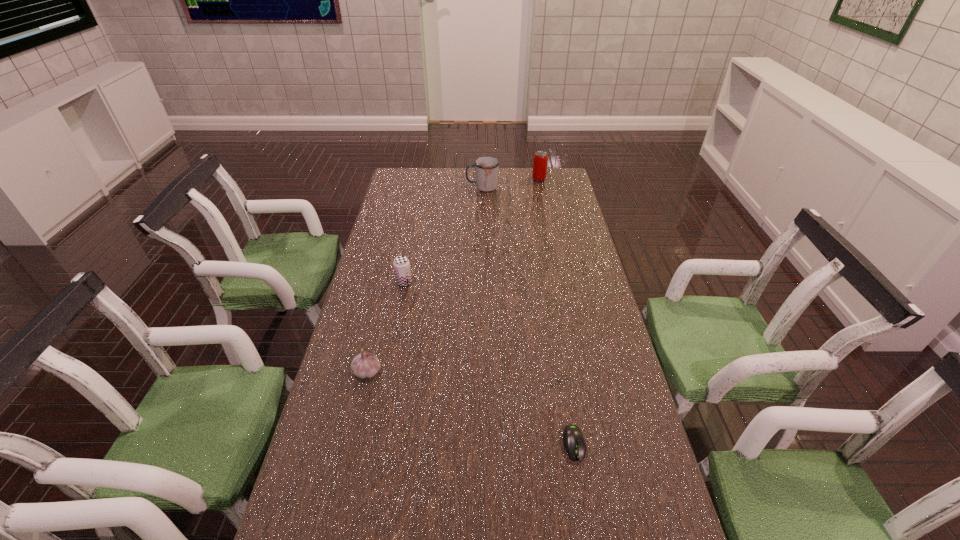
Find the location of `vacant space situated on the handle side of the mug`. vacant space situated on the handle side of the mug is located at coordinates (402, 187).

I want to click on free space located 0.270m on the handle side of the mug, so click(x=406, y=187).

You are a GUI agent. You are given a task and a screenshot of the screen. Output one action in this format:
    pyautogui.click(x=<x>, y=<y>)
    Task: Click on the vacant region located 0.360m on the back of the left beer can
    
    Given the screenshot: What is the action you would take?
    pyautogui.click(x=417, y=220)

This screenshot has width=960, height=540. Identify the location of free space located 0.140m on the right of the garlic. (432, 372).

Find the location of a particular element. vacant space located 0.110m on the wheel side of the shortest object is located at coordinates (586, 512).

Locate an element on the screen. Image resolution: width=960 pixels, height=540 pixels. beer can at the far edge is located at coordinates (539, 172).

This screenshot has height=540, width=960. Identify the location of mug at the far edge. [486, 168].

Identify the location of beer can present at the left edge. The image size is (960, 540). (401, 264).

In order to click on garlic located at the left edge in this screenshot , I will do `click(365, 365)`.

Where is `beer can present at the right edge`? This screenshot has width=960, height=540. beer can present at the right edge is located at coordinates (539, 172).